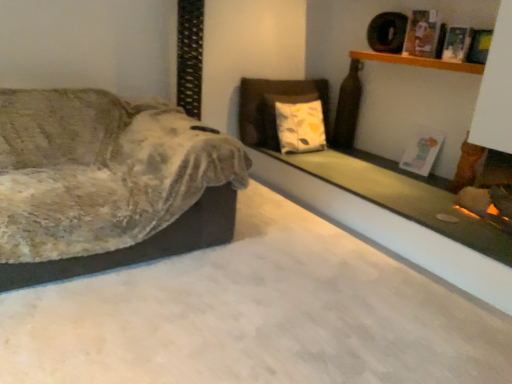
Question: Considering the relative positions of green matte glass at upper right and velvet fabric couch at left in the image provided, is green matte glass at upper right to the right of velvet fabric couch at left from the viewer's perspective?

Choices:
 (A) no
 (B) yes

Answer: (B)

Question: Is velvet fabric couch at left surrounded by green matte glass at upper right?

Choices:
 (A) no
 (B) yes

Answer: (A)

Question: Is green matte glass at upper right facing away from velvet fabric couch at left?

Choices:
 (A) no
 (B) yes

Answer: (A)

Question: Does green matte glass at upper right have a larger size compared to velvet fabric couch at left?

Choices:
 (A) yes
 (B) no

Answer: (B)

Question: Can you confirm if green matte glass at upper right is wider than velvet fabric couch at left?

Choices:
 (A) no
 (B) yes

Answer: (A)

Question: From a real-world perspective, is wooden shelf at upper right physically located above or below green matte glass at upper right?

Choices:
 (A) below
 (B) above

Answer: (B)

Question: Would you say wooden shelf at upper right is inside or outside green matte glass at upper right?

Choices:
 (A) inside
 (B) outside

Answer: (B)

Question: In the image, is wooden shelf at upper right positioned in front of or behind green matte glass at upper right?

Choices:
 (A) behind
 (B) front

Answer: (A)

Question: Considering the positions of wooden shelf at upper right and green matte glass at upper right in the image, is wooden shelf at upper right wider or thinner than green matte glass at upper right?

Choices:
 (A) wide
 (B) thin

Answer: (B)

Question: Considering the relative positions of green matte glass at upper right and wooden shelf at upper right in the image provided, is green matte glass at upper right to the left or to the right of wooden shelf at upper right?

Choices:
 (A) right
 (B) left

Answer: (B)

Question: Is point (437, 206) closer or farther from the camera than point (462, 72)?

Choices:
 (A) closer
 (B) farther

Answer: (A)

Question: Which is correct: green matte glass at upper right is inside wooden shelf at upper right, or outside of it?

Choices:
 (A) inside
 (B) outside

Answer: (B)

Question: In the image, is green matte glass at upper right positioned in front of or behind wooden shelf at upper right?

Choices:
 (A) front
 (B) behind

Answer: (A)

Question: Visually, is velvet fabric couch at left positioned to the left or to the right of green matte glass at upper right?

Choices:
 (A) left
 (B) right

Answer: (A)

Question: Is velvet fabric couch at left wider or thinner than green matte glass at upper right?

Choices:
 (A) wide
 (B) thin

Answer: (A)